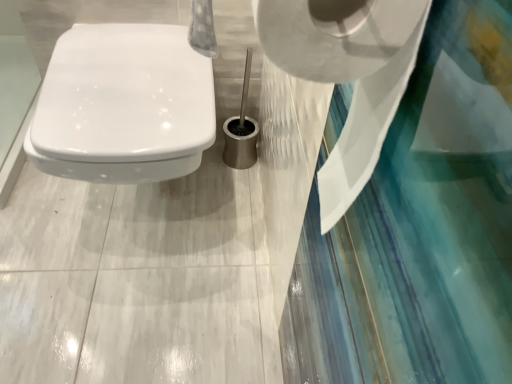
At what (x,y) coordinates should I click in order to perform the action: click on white matte toilet paper at center right. Please return your answer as a coordinate pair (x, y). Looking at the image, I should click on (348, 79).

This screenshot has height=384, width=512. What do you see at coordinates (348, 79) in the screenshot? I see `white matte toilet paper at center right` at bounding box center [348, 79].

Identify the location of white matte toilet paper at center right. (348, 79).